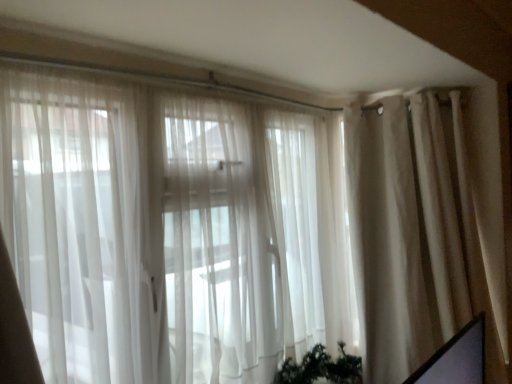
Where is `beige fabric curtain at right`? beige fabric curtain at right is located at coordinates coord(420,232).

What do you see at coordinates (420, 232) in the screenshot?
I see `beige fabric curtain at right` at bounding box center [420, 232].

The height and width of the screenshot is (384, 512). What do you see at coordinates (456, 358) in the screenshot?
I see `matte black screen at lower right` at bounding box center [456, 358].

I want to click on matte black screen at lower right, so click(456, 358).

Find the location of `beige fabric curtain at right`. beige fabric curtain at right is located at coordinates (420, 232).

Does matte black screen at lower right appear on the left side of beige fabric curtain at right?

Yes, matte black screen at lower right is to the left of beige fabric curtain at right.

Which object is more forward, matte black screen at lower right or beige fabric curtain at right?

matte black screen at lower right is closer to the camera.

Considering the positions of points (480, 325) and (435, 227), is point (480, 325) closer to camera compared to point (435, 227)?

Yes, it is in front of point (435, 227).

From the image's perspective, is matte black screen at lower right above beige fabric curtain at right?

No, from the image's perspective, matte black screen at lower right is not over beige fabric curtain at right.

From a real-world perspective, is matte black screen at lower right physically above beige fabric curtain at right?

No.

Is matte black screen at lower right thinner than beige fabric curtain at right?

Yes.

Can you confirm if matte black screen at lower right is taller than beige fabric curtain at right?

No, matte black screen at lower right is not taller than beige fabric curtain at right.

Looking at the image, does matte black screen at lower right seem bigger or smaller compared to beige fabric curtain at right?

Clearly, matte black screen at lower right is smaller in size than beige fabric curtain at right.

Is matte black screen at lower right positioned beyond the bounds of beige fabric curtain at right?

Yes, matte black screen at lower right is located beyond the bounds of beige fabric curtain at right.

Are matte black screen at lower right and beige fabric curtain at right far apart?

No, matte black screen at lower right is not far away from beige fabric curtain at right.

Could you tell me if matte black screen at lower right is facing beige fabric curtain at right?

No, matte black screen at lower right is not facing towards beige fabric curtain at right.

Locate an element on the screen. computer screen below the beige fabric curtain at right (from the image's perspective) is located at coordinates (456, 358).

Which is more to the left, beige fabric curtain at right or matte black screen at lower right?

matte black screen at lower right.

Considering the positions of objects beige fabric curtain at right and matte black screen at lower right in the image provided, who is behind, beige fabric curtain at right or matte black screen at lower right?

beige fabric curtain at right is more distant.

Is point (410, 219) positioned in front of point (443, 373)?

No, it is not.

From the image's perspective, is beige fabric curtain at right over matte black screen at lower right?

Yes, from the image's perspective, beige fabric curtain at right is over matte black screen at lower right.

From a real-world perspective, is beige fabric curtain at right under matte black screen at lower right?

No.

Considering the sizes of objects beige fabric curtain at right and matte black screen at lower right in the image provided, who is wider, beige fabric curtain at right or matte black screen at lower right?

With larger width is beige fabric curtain at right.

Which of these two, beige fabric curtain at right or matte black screen at lower right, stands shorter?

With less height is matte black screen at lower right.

Does beige fabric curtain at right have a larger size compared to matte black screen at lower right?

Correct, beige fabric curtain at right is larger in size than matte black screen at lower right.

Is beige fabric curtain at right not within matte black screen at lower right?

Yes, beige fabric curtain at right is outside of matte black screen at lower right.

Can you see beige fabric curtain at right touching matte black screen at lower right?

No, beige fabric curtain at right is not in contact with matte black screen at lower right.

Is beige fabric curtain at right facing towards matte black screen at lower right?

Yes, beige fabric curtain at right is turned towards matte black screen at lower right.

What are the coordinates of `computer screen on the left side of beige fabric curtain at right` in the screenshot? It's located at 456,358.

Identify the location of computer screen lying below the beige fabric curtain at right (from the image's perspective). (456, 358).

At what (x,y) coordinates should I click in order to perform the action: click on computer screen located in front of the beige fabric curtain at right. Please return your answer as a coordinate pair (x, y). This screenshot has width=512, height=384. Looking at the image, I should click on (456, 358).